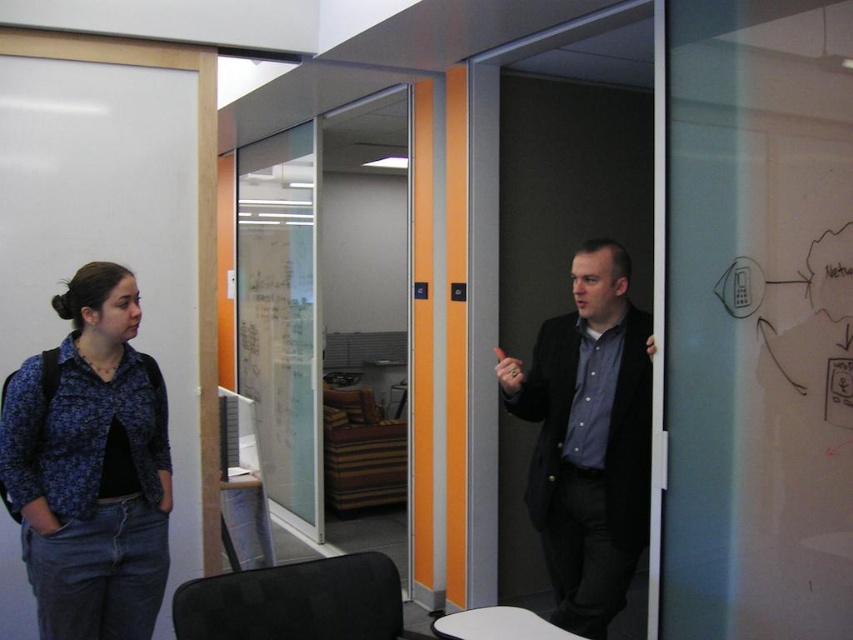
Question: Can you confirm if blue floral shirt at left is wider than matte black suit at center?

Choices:
 (A) no
 (B) yes

Answer: (A)

Question: Which object is farther from the camera taking this photo?

Choices:
 (A) blue floral shirt at left
 (B) matte black suit at center

Answer: (B)

Question: Does transparent glass door at center have a greater width compared to matte black suit at center?

Choices:
 (A) yes
 (B) no

Answer: (A)

Question: Which point is farther to the camera?

Choices:
 (A) (509, 368)
 (B) (163, 522)
 (C) (254, 237)

Answer: (C)

Question: Does blue floral shirt at left lie in front of matte black suit at center?

Choices:
 (A) no
 (B) yes

Answer: (B)

Question: Based on their relative distances, which object is farther from the blue floral shirt at left?

Choices:
 (A) matte black suit at center
 (B) transparent glass door at center

Answer: (B)